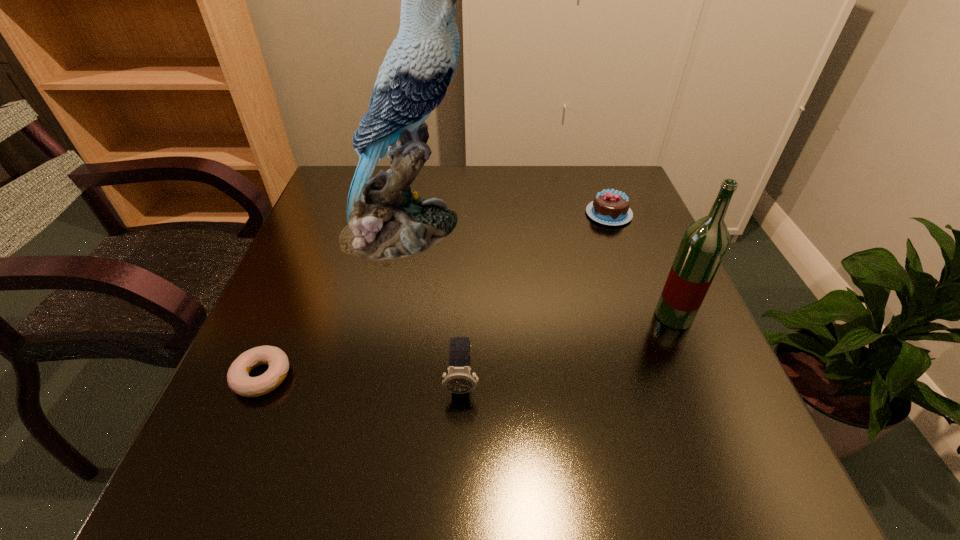
Find the location of a particular element. vacant space that satisfies the following two spatial constraints: 1. on the face of the third farthest object; 2. on the left side of the tallest object is located at coordinates (386, 316).